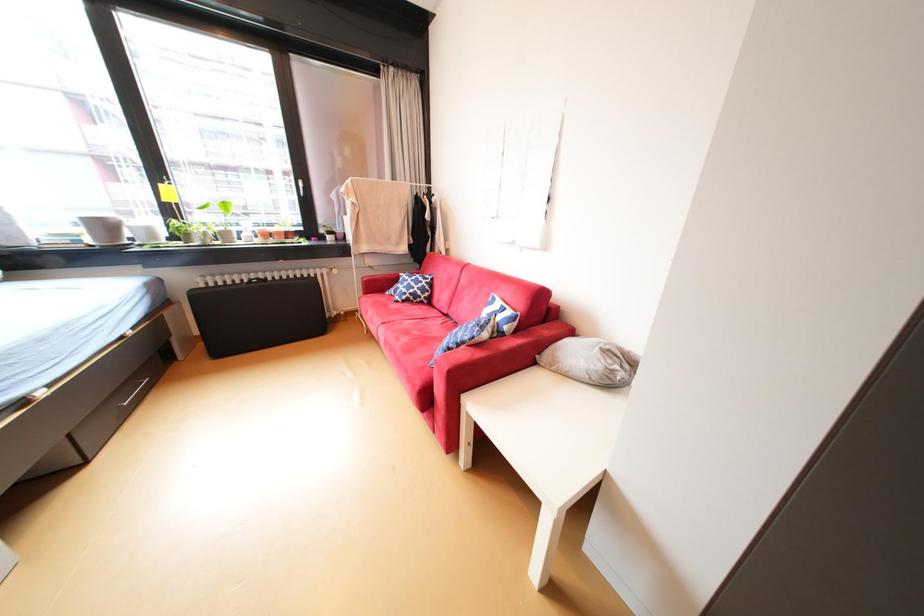
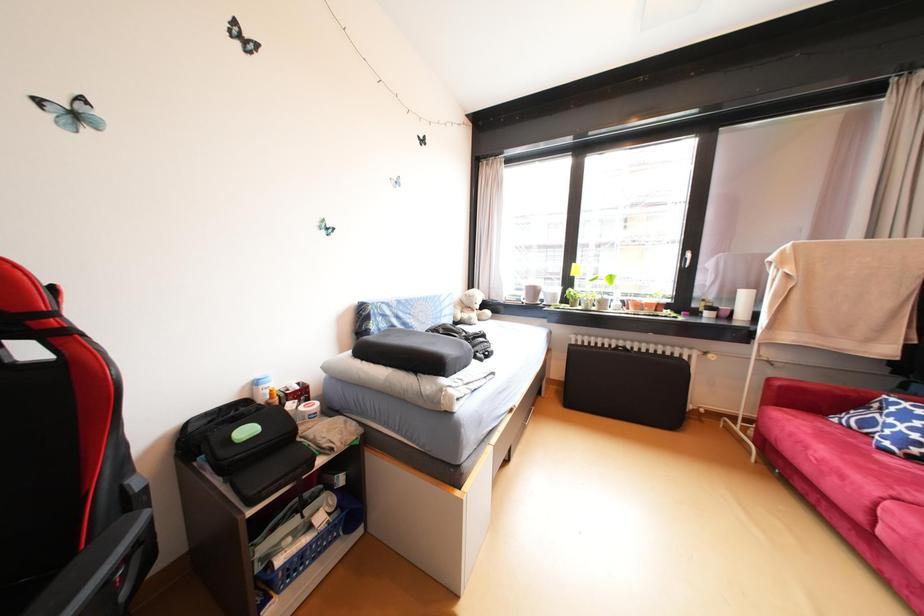
Question: How did the camera likely rotate?

Choices:
 (A) Left
 (B) Right
 (C) Up
 (D) Down

Answer: (A)